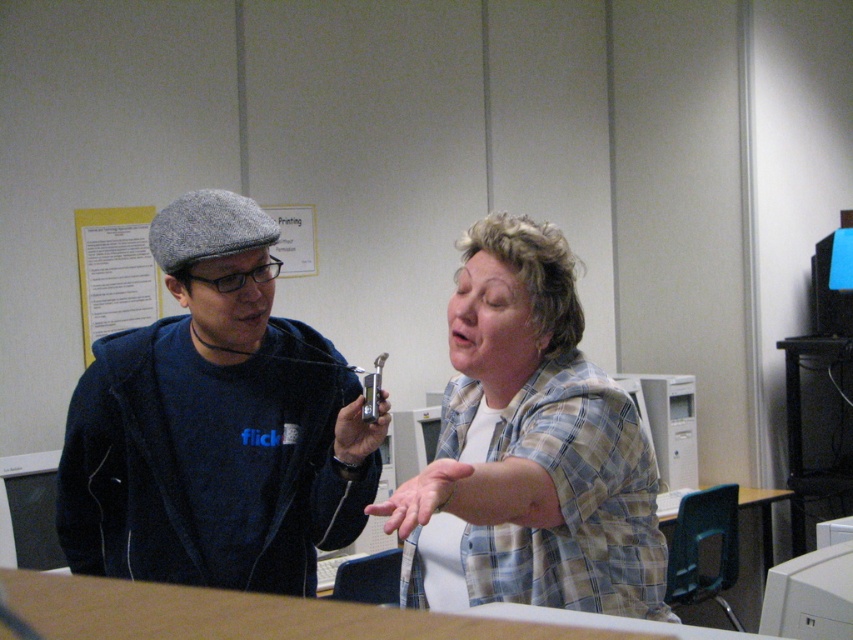
Question: Which point is closer to the camera?

Choices:
 (A) plaid shirt at center
 (B) dark blue fabric sweatshirt at left

Answer: (A)

Question: Does dark blue fabric sweatshirt at left come in front of plaid shirt at center?

Choices:
 (A) no
 (B) yes

Answer: (A)

Question: Among these objects, which one is nearest to the camera?

Choices:
 (A) dark blue fabric sweatshirt at left
 (B) plaid shirt at center

Answer: (B)

Question: Does dark blue fabric sweatshirt at left have a lesser width compared to plaid shirt at center?

Choices:
 (A) no
 (B) yes

Answer: (A)

Question: Does dark blue fabric sweatshirt at left have a greater width compared to plaid shirt at center?

Choices:
 (A) yes
 (B) no

Answer: (A)